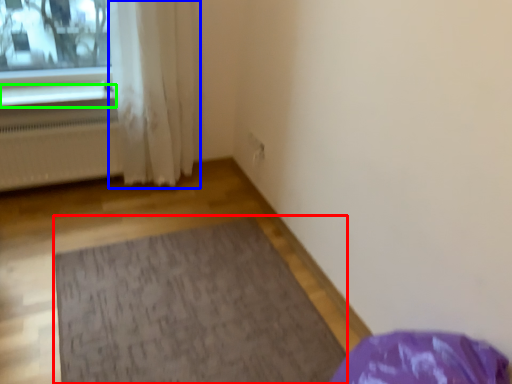
Question: Which object is positioned closest to mat (highlighted by a red box)? Select from curtain (highlighted by a blue box) and window sill (highlighted by a green box).

Choices:
 (A) curtain
 (B) window sill

Answer: (A)